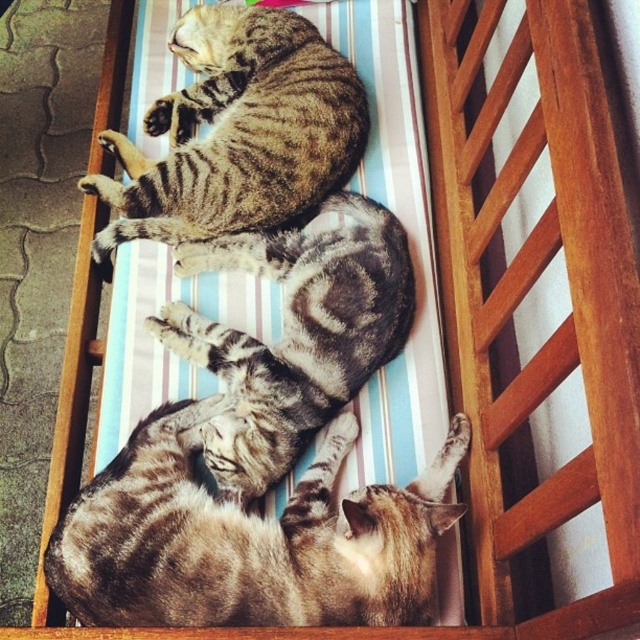
Question: Which object is closer to the camera taking this photo?

Choices:
 (A) tabby fur cat at upper center
 (B) golden tabby cat at lower left
 (C) tabby fur cat at center

Answer: (B)

Question: Where is golden tabby cat at lower left located in relation to tabby fur cat at center in the image?

Choices:
 (A) below
 (B) above

Answer: (A)

Question: Is golden tabby cat at lower left thinner than tabby fur cat at upper center?

Choices:
 (A) yes
 (B) no

Answer: (B)

Question: Is golden tabby cat at lower left smaller than tabby fur cat at upper center?

Choices:
 (A) yes
 (B) no

Answer: (A)

Question: Which of the following is the farthest from the observer?

Choices:
 (A) (243, 381)
 (B) (166, 605)
 (C) (108, 136)

Answer: (C)

Question: Among these points, which one is nearest to the camera?

Choices:
 (A) (211, 20)
 (B) (154, 625)

Answer: (B)